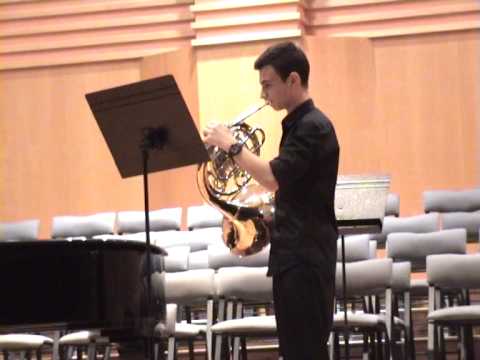
This screenshot has width=480, height=360. Find the location of `yellow portion of wall`. yellow portion of wall is located at coordinates (226, 86).